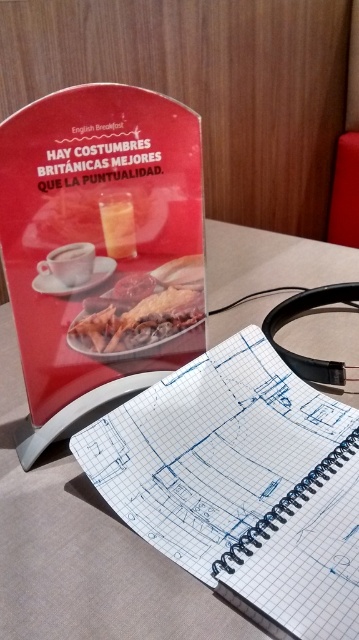
Does black rubber headphones at center appear under matte white cup at upper left?

Yes.

Is black rubber headphones at center wider than matte white cup at upper left?

Indeed, black rubber headphones at center has a greater width compared to matte white cup at upper left.

Where is `black rubber headphones at center`? This screenshot has height=640, width=359. black rubber headphones at center is located at coordinates (301, 310).

Between golden crispy chicken at center and matte white cup at upper left, which one is positioned lower?

Positioned lower is golden crispy chicken at center.

What do you see at coordinates (142, 310) in the screenshot? I see `golden crispy chicken at center` at bounding box center [142, 310].

Identify the location of golden crispy chicken at center. The image size is (359, 640). (142, 310).

The width and height of the screenshot is (359, 640). What are the coordinates of `golden crispy chicken at center` in the screenshot? It's located at (142, 310).

Which of these two, golden crispy chicken at center or black rubber headphones at center, stands shorter?

Standing shorter between the two is golden crispy chicken at center.

Between point (137, 291) and point (276, 342), which one is positioned in front?

Positioned in front is point (137, 291).

This screenshot has height=640, width=359. What are the coordinates of `golden crispy chicken at center` in the screenshot? It's located at (142, 310).